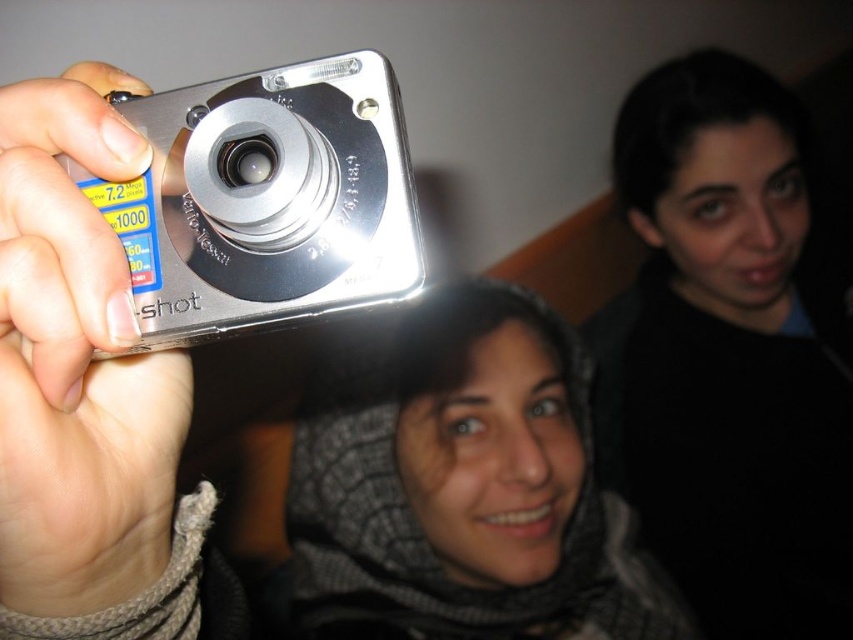
You are a photographer trying to capture a candid shot of the black matte scarf at upper center. However, the silver metallic camera at left is blocking your view. Can you adjust your position to see the scarf without moving the camera?

The silver metallic camera at left is behind the black matte scarf at upper center, so adjusting your position slightly might allow you to see the scarf without moving the camera since the scarf is in front.

In the scene shown: You are a photographer analyzing the composition of this image. The black matte scarf at upper center is part of the background. Based on its position, can you determine if it is located in the upper half or lower half of the image?

The black matte scarf at upper center is located at point coordinates of [729,355]. Since the y coordinate is 0.856, which is greater than 0.5, it is in the upper half of the image.

You are trying to take a photo with the silver metallic camera at upper left and the silver metallic camera at left in the frame. Which camera should you focus on first if you want to capture both in the same shot?

The silver metallic camera at upper left is positioned under the silver metallic camera at left, so you should focus on the silver metallic camera at left first as it is higher up and more likely to be in the foreground.